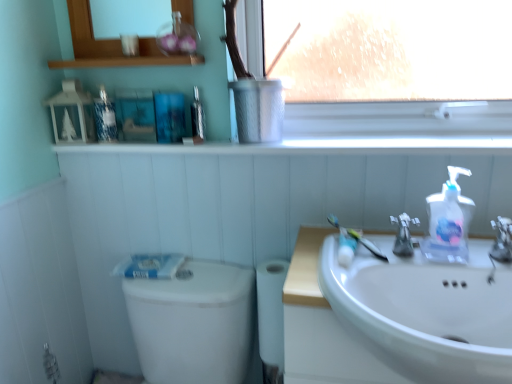
Question: From a real-world perspective, is metallic silver mouthwash at upper center, positioned as the first mouthwash in right-to-left order, located higher than satin nickel faucet at sink right, the 2th tap viewed from the right?

Choices:
 (A) yes
 (B) no

Answer: (A)

Question: From a real-world perspective, is metallic silver mouthwash at upper center, the second mouthwash from the left, under satin nickel faucet at sink right, the 2th tap viewed from the right?

Choices:
 (A) yes
 (B) no

Answer: (B)

Question: Is metallic silver mouthwash at upper center, positioned as the first mouthwash in right-to-left order, further to camera compared to satin nickel faucet at sink right, arranged as the 1th tap when viewed from the left?

Choices:
 (A) yes
 (B) no

Answer: (A)

Question: Is metallic silver mouthwash at upper center, the second mouthwash from the left, taller than satin nickel faucet at sink right, the 2th tap viewed from the right?

Choices:
 (A) no
 (B) yes

Answer: (B)

Question: From the image's perspective, does metallic silver mouthwash at upper center, positioned as the first mouthwash in right-to-left order, appear lower than satin nickel faucet at sink right, the 2th tap viewed from the right?

Choices:
 (A) no
 (B) yes

Answer: (A)

Question: Considering the relative positions of metallic silver mouthwash at upper center, the second mouthwash from the left, and satin nickel faucet at sink right, arranged as the 1th tap when viewed from the left, in the image provided, is metallic silver mouthwash at upper center, the second mouthwash from the left, to the left of satin nickel faucet at sink right, arranged as the 1th tap when viewed from the left, from the viewer's perspective?

Choices:
 (A) no
 (B) yes

Answer: (B)

Question: From the image's perspective, is white matte toilet paper at lower center over satin nickel faucet at sink right, which ranks as the 1th tap in right-to-left order?

Choices:
 (A) yes
 (B) no

Answer: (B)

Question: Is white matte toilet paper at lower center smaller than satin nickel faucet at sink right, which ranks as the 2th tap in left-to-right order?

Choices:
 (A) yes
 (B) no

Answer: (B)

Question: From the image's perspective, is white matte toilet paper at lower center located beneath satin nickel faucet at sink right, which ranks as the 1th tap in right-to-left order?

Choices:
 (A) no
 (B) yes

Answer: (B)

Question: Is white matte toilet paper at lower center with satin nickel faucet at sink right, which ranks as the 1th tap in right-to-left order?

Choices:
 (A) no
 (B) yes

Answer: (A)

Question: From a real-world perspective, is white matte toilet paper at lower center located higher than satin nickel faucet at sink right, which ranks as the 2th tap in left-to-right order?

Choices:
 (A) no
 (B) yes

Answer: (A)

Question: Does white matte toilet paper at lower center have a larger size compared to satin nickel faucet at sink right, which ranks as the 2th tap in left-to-right order?

Choices:
 (A) yes
 (B) no

Answer: (A)

Question: Is metallic silver window sill at upper center, the 1th window sill positioned from the top, to the left of metallic silver mouthwash at upper center, the second mouthwash from the left, from the viewer's perspective?

Choices:
 (A) no
 (B) yes

Answer: (B)